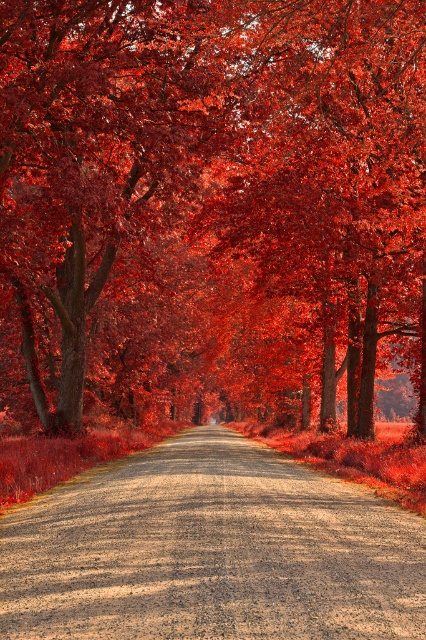
Question: Among these objects, which one is nearest to the camera?

Choices:
 (A) dirt/gravel road at center
 (B) smooth bark tree at center

Answer: (A)

Question: Does smooth bark tree at center appear on the left side of dirt/gravel road at center?

Choices:
 (A) yes
 (B) no

Answer: (A)

Question: Does smooth bark tree at center appear under dirt/gravel road at center?

Choices:
 (A) yes
 (B) no

Answer: (B)

Question: Can you confirm if smooth bark tree at center is bigger than dirt/gravel road at center?

Choices:
 (A) no
 (B) yes

Answer: (B)